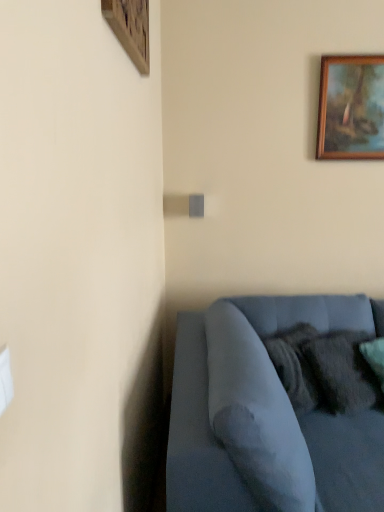
Question: In the image, is wooden picture frame at upper right, which is the 2th picture frame from front to back, on the left side or the right side of wooden picture frame at upper left, the 2th picture frame viewed from the back?

Choices:
 (A) right
 (B) left

Answer: (A)

Question: Is point (342, 57) closer or farther from the camera than point (117, 10)?

Choices:
 (A) closer
 (B) farther

Answer: (B)

Question: Considering the real-world distances, which object is farthest from the velvety dark gray pillow at lower right?

Choices:
 (A) wooden picture frame at upper left, which is counted as the 1th picture frame, starting from the front
 (B) velvet blue couch at lower right
 (C) wooden picture frame at upper right, marked as the 1th picture frame in a back-to-front arrangement

Answer: (A)

Question: Estimate the real-world distances between objects in this image. Which object is farther from the velvet blue couch at lower right?

Choices:
 (A) velvety dark gray pillow at lower right
 (B) wooden picture frame at upper left, which is counted as the 2th picture frame, starting from the right
 (C) wooden picture frame at upper right, which is counted as the second picture frame, starting from the left

Answer: (C)